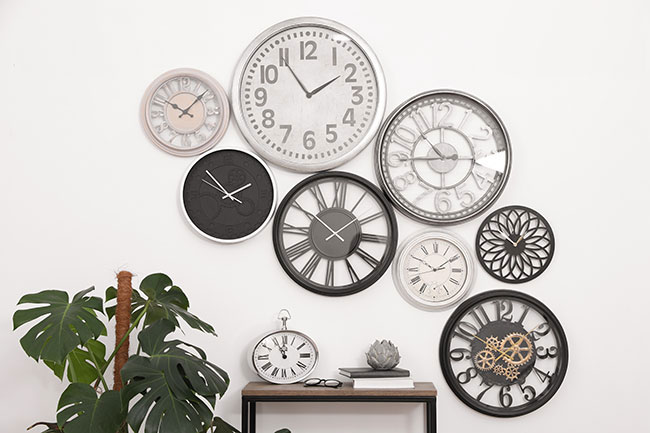
The width and height of the screenshot is (650, 433). In order to click on clocks with numbers in this screenshot , I will do `click(202, 126)`, `click(288, 119)`, `click(462, 177)`, `click(481, 322)`.